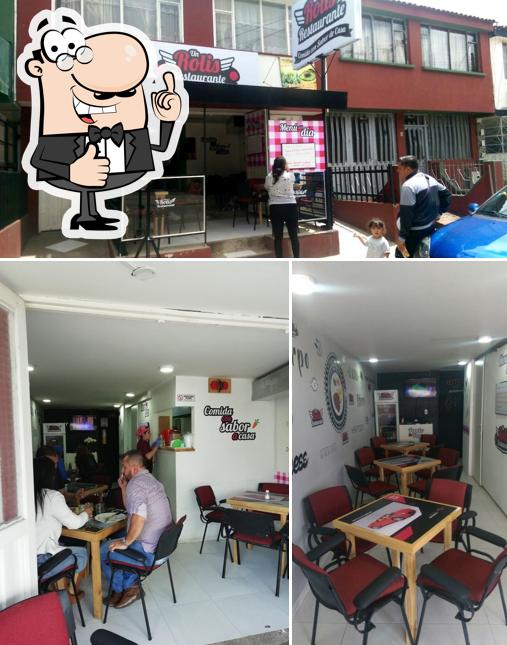
Identify the location of place to sit at. The height and width of the screenshot is (645, 507). pos(328,510), pos(339,571), pos(461,568), pos(446,491).